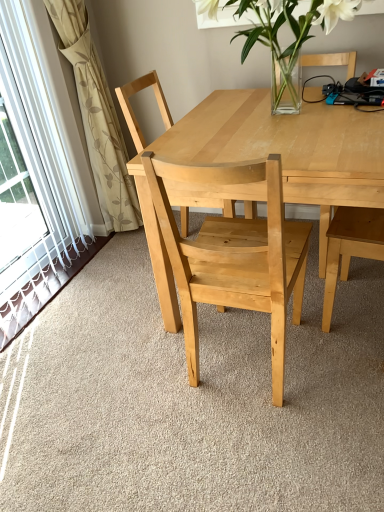
This screenshot has height=512, width=384. Identify the location of blank area beneath beige floral fabric at left (from a real-world perspective). (122, 241).